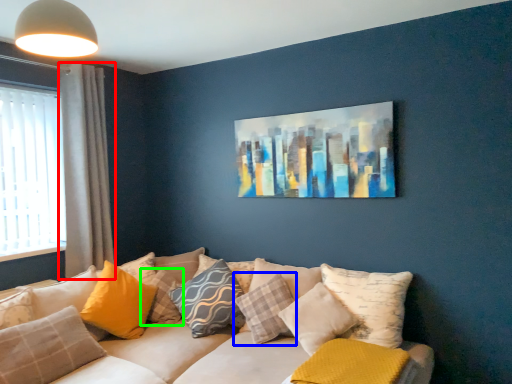
Question: Considering the real-world distances, which object is farthest from curtain (highlighted by a red box)? pillow (highlighted by a blue box) or pillow (highlighted by a green box)?

Choices:
 (A) pillow
 (B) pillow

Answer: (A)